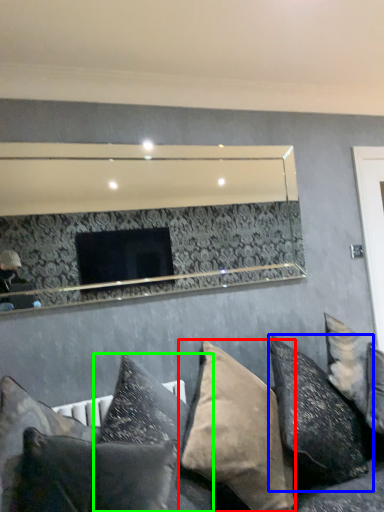
Question: Which object is the closest to the pillow (highlighted by a red box)? Choose among these: pillow (highlighted by a blue box) or pillow (highlighted by a green box).

Choices:
 (A) pillow
 (B) pillow

Answer: (B)